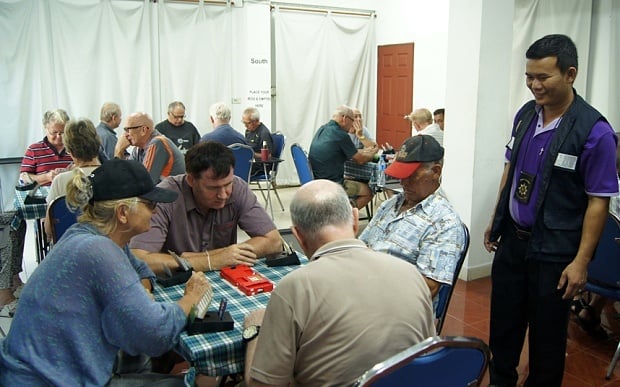
Find the location of a particular element. The height and width of the screenshot is (387, 620). tables is located at coordinates (33, 202), (253, 304), (372, 169).